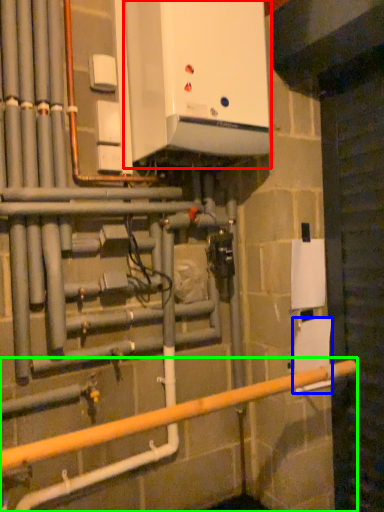
Question: Which object is the farthest from home appliance (highlighted by a red box)? Choose among these: toilet paper (highlighted by a blue box) or rail (highlighted by a green box).

Choices:
 (A) toilet paper
 (B) rail

Answer: (B)